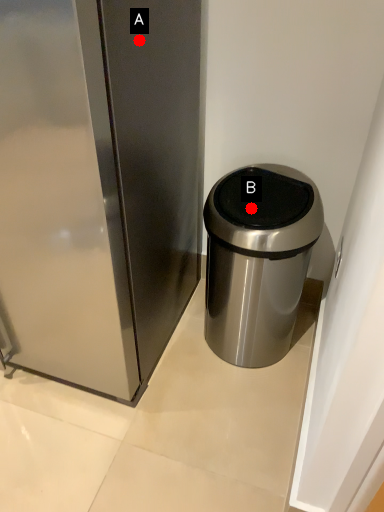
Question: Two points are circled on the image, labeled by A and B beside each circle. Which point is farther to the camera?

Choices:
 (A) A is further
 (B) B is further

Answer: (B)